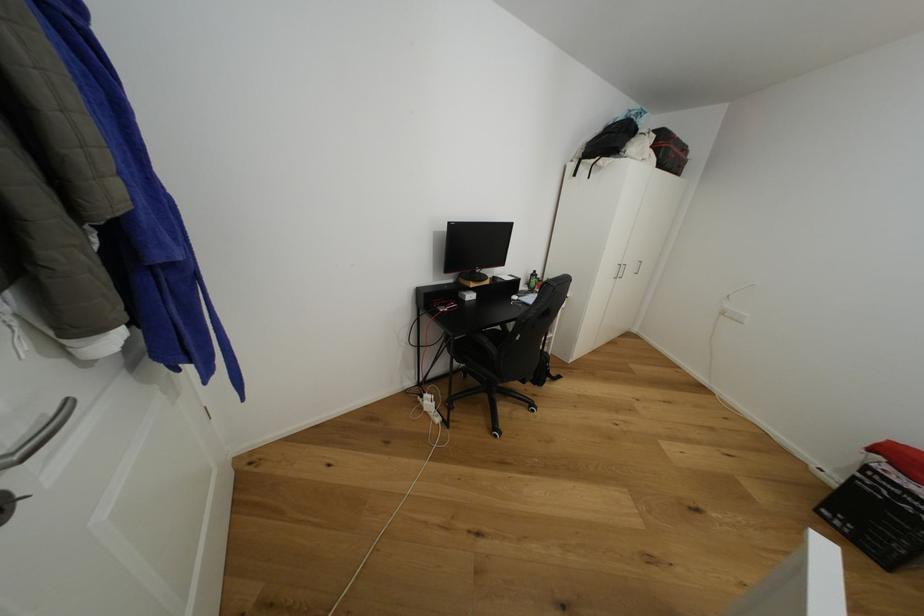
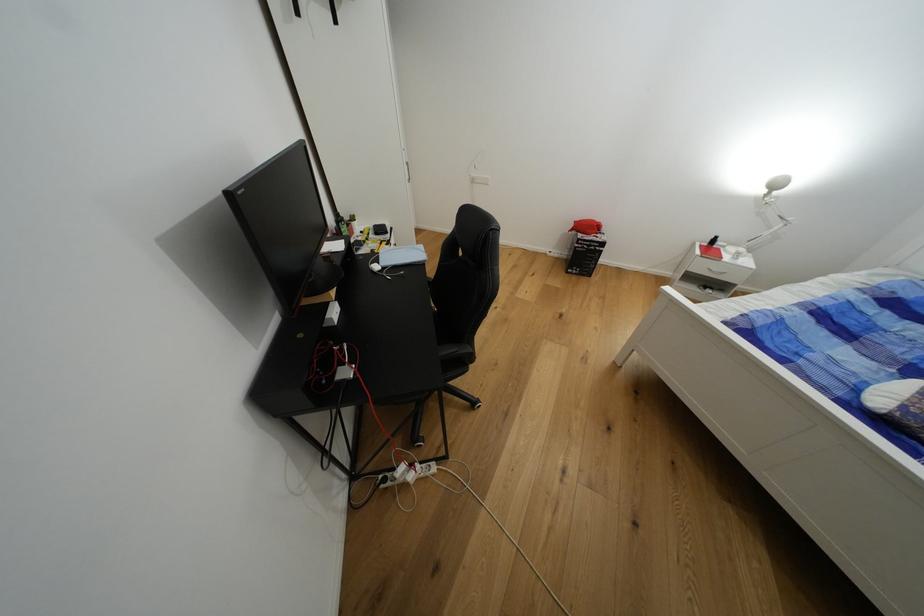
The point at (525, 298) is marked in the first image. Where is the corresponding point in the second image?

(383, 262)